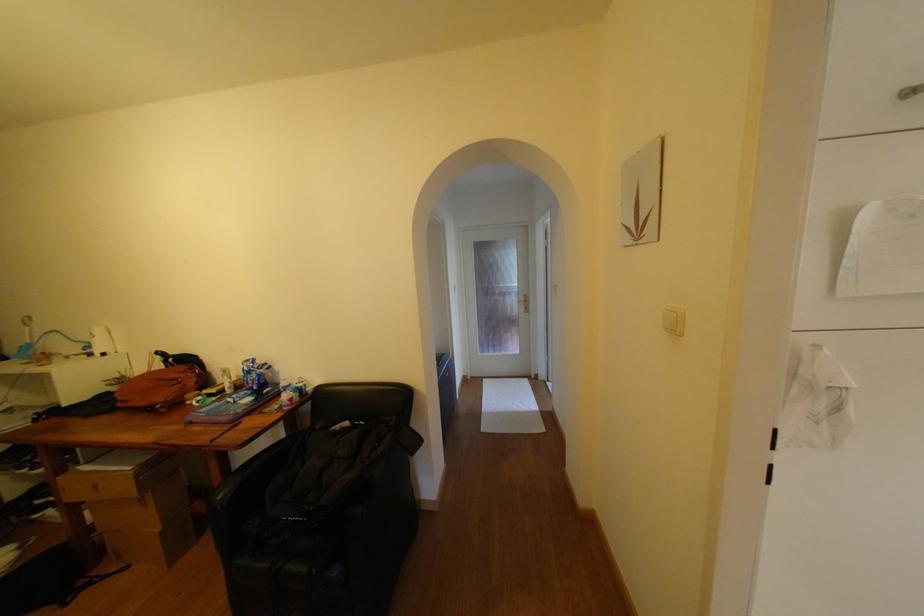
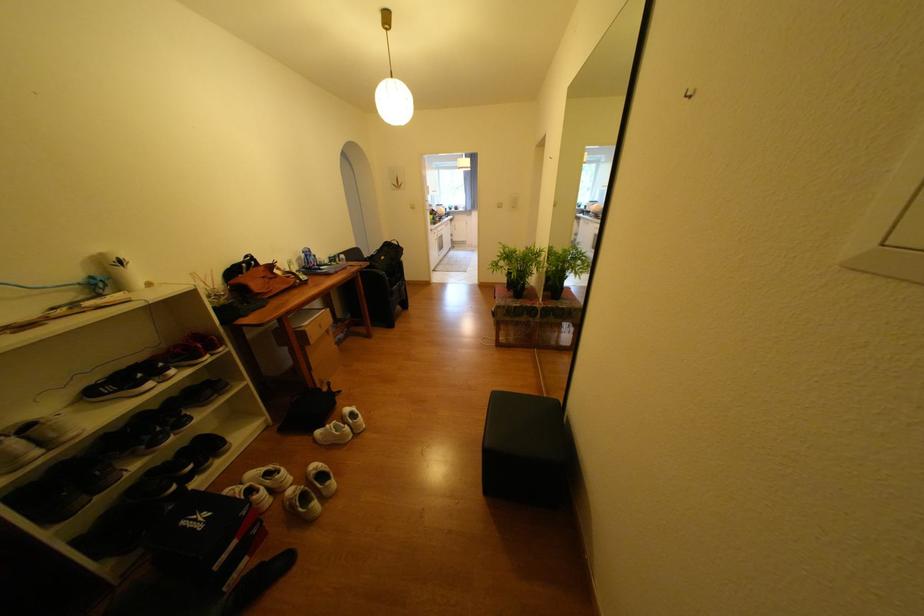
In the second image, find the point that corresponds to (x=190, y=369) in the first image.

(271, 269)